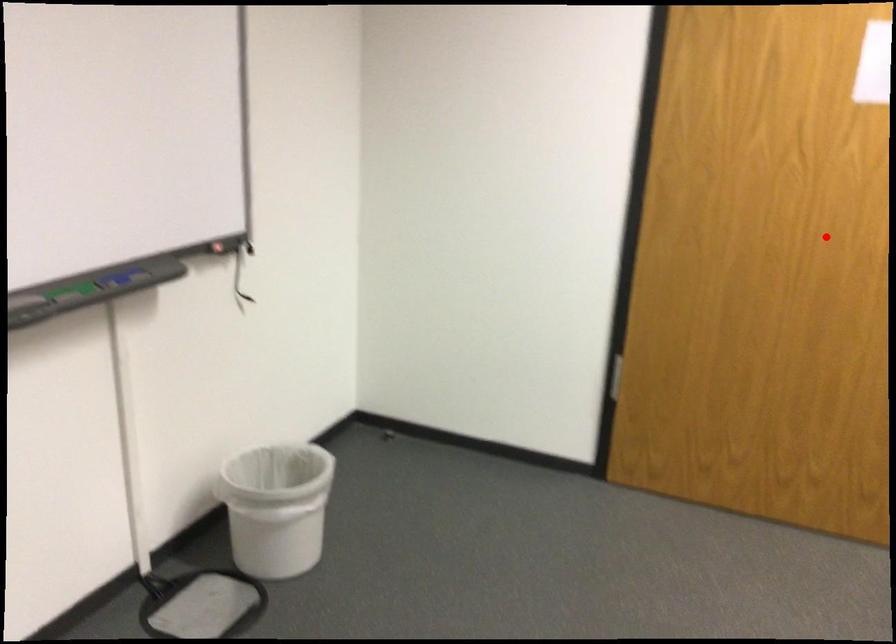
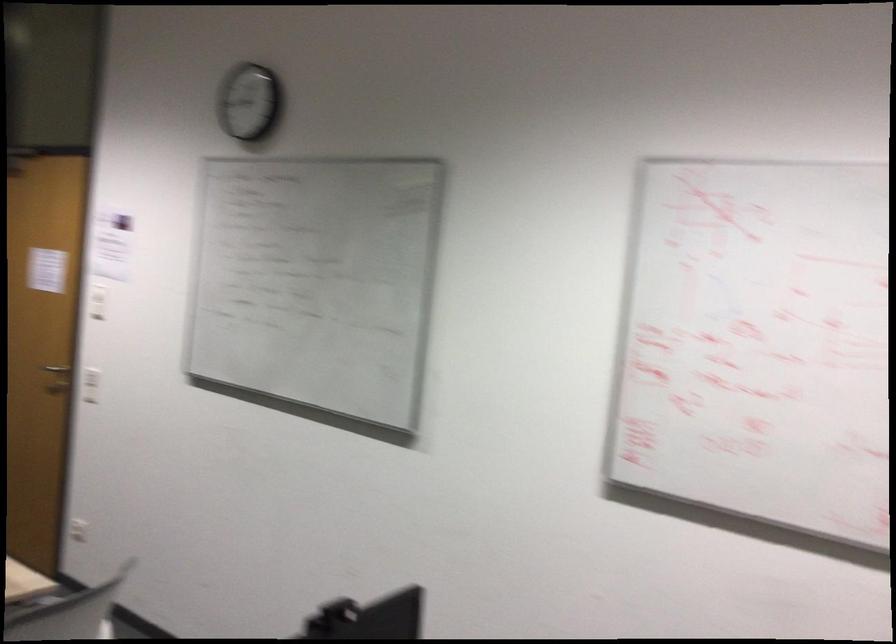
In the second image, find the point that corresponds to the highlighted location in the first image.

(56, 368)